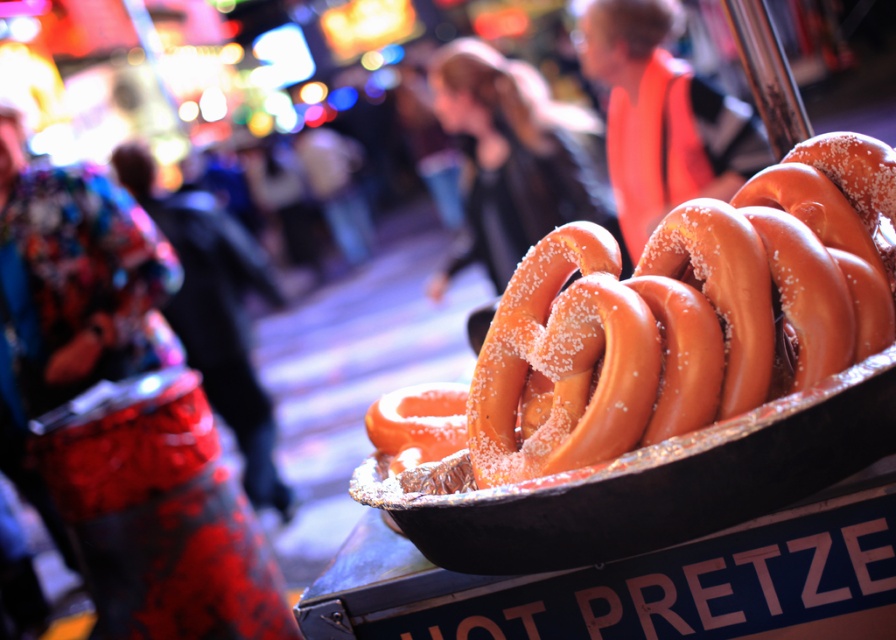
Question: Which object is farther from the camera taking this photo?

Choices:
 (A) sugared pretzel at right
 (B) sugared golden pretzel at right

Answer: (A)

Question: Considering the relative positions of sugared golden pretzel at right and sugared pretzel at right in the image provided, where is sugared golden pretzel at right located with respect to sugared pretzel at right?

Choices:
 (A) left
 (B) right

Answer: (A)

Question: Is sugared golden pretzel at right smaller than sugared pretzel at right?

Choices:
 (A) no
 (B) yes

Answer: (B)

Question: Is sugared golden pretzel at right closer to camera compared to sugared pretzel at right?

Choices:
 (A) yes
 (B) no

Answer: (A)